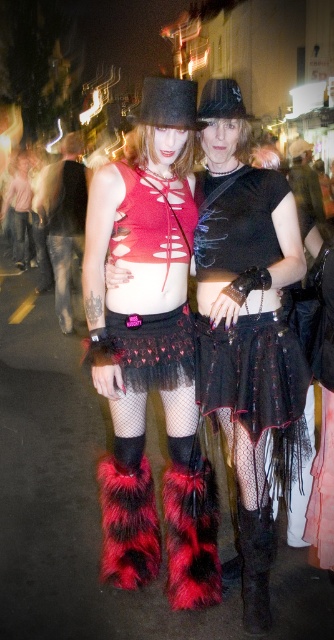
You are a photographer trying to capture the best shot of the two people in the image. You notice a point at coordinates (150, 353) which is marked as fuzzy fur boots at lower center. Where exactly should you focus your camera to ensure the fuzzy fur boots at lower center are in sharp focus?

The point at coordinates (150, 353) marks the location of the fuzzy fur boots at lower center, so focusing your camera on that specific coordinate will ensure the fuzzy fur boots at lower center are in sharp focus.

You are a photographer trying to capture a closeup shot of the fuzzy fur boots at lower center. Based on their position in the image, can you estimate how far they are from the edge of the frame?

The fuzzy fur boots at lower center are located at point coordinates of 0.553 on the x axis and 0.452 on the y axis, so they are approximately 55.3 percent from the left edge and 45.2 percent from the bottom edge of the frame.

You are a photographer trying to capture a closeup of the fuzzy fur boots at lower center. Given their exact coordinates at point 0.553, 0.452, where should you position your camera relative to the scene?

The fuzzy fur boots at lower center are located at coordinates (150, 353), so you should position your camera directly facing the lower center area of the scene to capture them in focus.